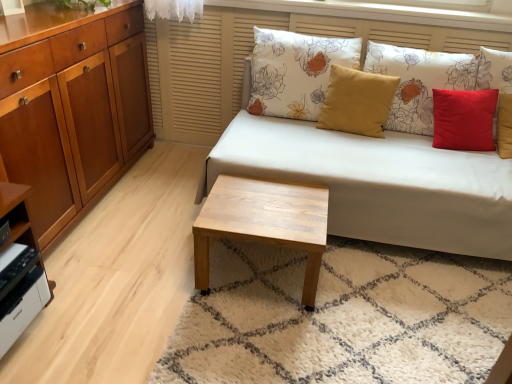
Question: Considering the relative positions of red matte pillow at upper right, marked as the first pillow in a right-to-left arrangement, and light wood/texture coffee table at center in the image provided, is red matte pillow at upper right, marked as the first pillow in a right-to-left arrangement, to the right of light wood/texture coffee table at center from the viewer's perspective?

Choices:
 (A) no
 (B) yes

Answer: (B)

Question: Does red matte pillow at upper right, marked as the first pillow in a right-to-left arrangement, have a lesser height compared to light wood/texture coffee table at center?

Choices:
 (A) no
 (B) yes

Answer: (A)

Question: Does red matte pillow at upper right, which ranks as the 3th pillow in left-to-right order, come behind light wood/texture coffee table at center?

Choices:
 (A) no
 (B) yes

Answer: (B)

Question: Does red matte pillow at upper right, which ranks as the 3th pillow in left-to-right order, have a lesser width compared to light wood/texture coffee table at center?

Choices:
 (A) yes
 (B) no

Answer: (A)

Question: Considering the relative sizes of red matte pillow at upper right, marked as the first pillow in a right-to-left arrangement, and light wood/texture coffee table at center in the image provided, is red matte pillow at upper right, marked as the first pillow in a right-to-left arrangement, wider than light wood/texture coffee table at center?

Choices:
 (A) yes
 (B) no

Answer: (B)

Question: Does red matte pillow at upper right, marked as the first pillow in a right-to-left arrangement, have a greater height compared to light wood/texture coffee table at center?

Choices:
 (A) yes
 (B) no

Answer: (A)

Question: From a real-world perspective, is light wood/texture coffee table at center over white fabric couch at center?

Choices:
 (A) yes
 (B) no

Answer: (B)

Question: Is light wood/texture coffee table at center shorter than white fabric couch at center?

Choices:
 (A) yes
 (B) no

Answer: (A)

Question: Does light wood/texture coffee table at center appear on the right side of white fabric couch at center?

Choices:
 (A) no
 (B) yes

Answer: (A)

Question: From the image's perspective, is light wood/texture coffee table at center located beneath white fabric couch at center?

Choices:
 (A) yes
 (B) no

Answer: (A)

Question: Does light wood/texture coffee table at center have a lesser width compared to white fabric couch at center?

Choices:
 (A) yes
 (B) no

Answer: (A)

Question: Is light wood/texture coffee table at center aimed at white fabric couch at center?

Choices:
 (A) no
 (B) yes

Answer: (A)

Question: Would you say white matte printer at lower left is a long distance from matte yellow pillow at center, the second pillow when ordered from left to right?

Choices:
 (A) no
 (B) yes

Answer: (B)